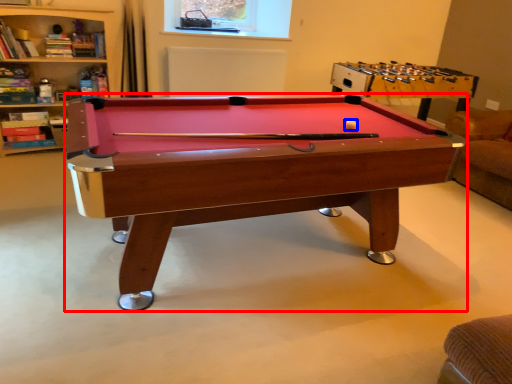
Question: Which point is further to the camera, billiard table (highlighted by a red box) or ball (highlighted by a blue box)?

Choices:
 (A) billiard table
 (B) ball

Answer: (B)